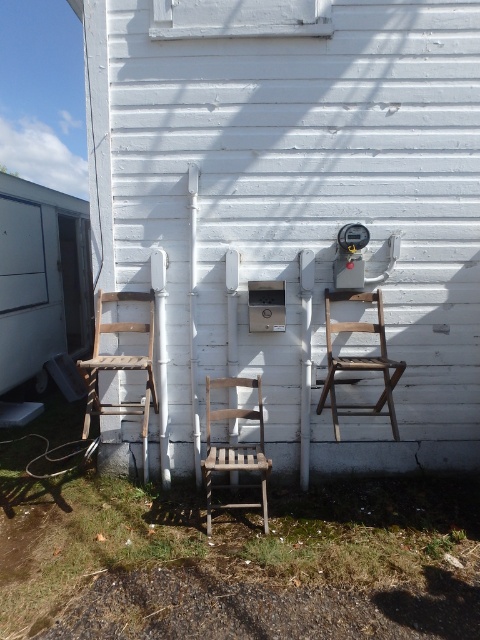
Describe the element at coordinates (359, 362) in the screenshot. I see `wooden chair at center` at that location.

Between wooden chair at center and wooden slatted chair at center, which one is positioned lower?

Positioned lower is wooden slatted chair at center.

The height and width of the screenshot is (640, 480). I want to click on wooden chair at center, so click(x=359, y=362).

Identify the location of wooden chair at center. (359, 362).

In the scene shown: Does wooden chair at center have a greater width compared to wooden chair at left?

Yes.

Who is more forward, (x=330, y=339) or (x=108, y=294)?

Positioned in front is point (x=330, y=339).

At what (x,y) coordinates should I click in order to perform the action: click on wooden chair at center. Please return your answer as a coordinate pair (x, y). The width and height of the screenshot is (480, 640). Looking at the image, I should click on (359, 362).

Does wooden slatted chair at center appear under wooden chair at left?

Correct, wooden slatted chair at center is located below wooden chair at left.

Which is more to the right, wooden slatted chair at center or wooden chair at left?

wooden slatted chair at center is more to the right.

Who is more distant from viewer, (x=206, y=508) or (x=112, y=328)?

Positioned behind is point (x=112, y=328).

In order to click on wooden slatted chair at center in this screenshot , I will do `click(235, 448)`.